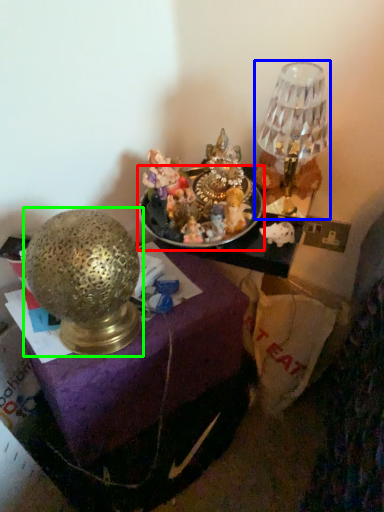
Question: Based on their relative distances, which object is nearer to tableware (highlighted by a red box)? Choose from lamp (highlighted by a blue box) and lamp (highlighted by a green box).

Choices:
 (A) lamp
 (B) lamp

Answer: (A)